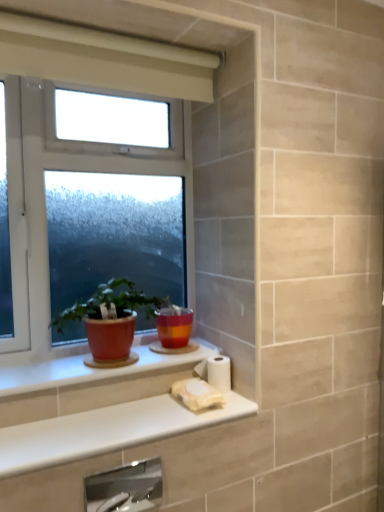
Question: From a real-world perspective, is white matte toilet paper at lower center, which is the second toilet paper from bottom to top, over white plastic window at center?

Choices:
 (A) no
 (B) yes

Answer: (A)

Question: Is white matte toilet paper at lower center, which is the second toilet paper from bottom to top, at the left side of white plastic window at center?

Choices:
 (A) yes
 (B) no

Answer: (B)

Question: Is white matte toilet paper at lower center, which is the first toilet paper from top to bottom, far away from white plastic window at center?

Choices:
 (A) yes
 (B) no

Answer: (B)

Question: Can you confirm if white matte toilet paper at lower center, which is the second toilet paper from bottom to top, is positioned to the right of white plastic window at center?

Choices:
 (A) yes
 (B) no

Answer: (A)

Question: Could you tell me if white matte toilet paper at lower center, which is the first toilet paper from top to bottom, is facing white plastic window at center?

Choices:
 (A) yes
 (B) no

Answer: (B)

Question: Does point (183, 361) appear closer or farther from the camera than point (127, 472)?

Choices:
 (A) farther
 (B) closer

Answer: (B)

Question: Looking at their shapes, would you say matte ceramic window sill at lower left is wider or thinner than satin nickel faucet at lower center?

Choices:
 (A) thin
 (B) wide

Answer: (B)

Question: From the image's perspective, is matte ceramic window sill at lower left above or below satin nickel faucet at lower center?

Choices:
 (A) above
 (B) below

Answer: (A)

Question: In terms of height, does matte ceramic window sill at lower left look taller or shorter compared to satin nickel faucet at lower center?

Choices:
 (A) short
 (B) tall

Answer: (A)

Question: Based on their sizes in the image, would you say matte ceramic pot at window is bigger or smaller than satin nickel faucet at lower center?

Choices:
 (A) big
 (B) small

Answer: (A)

Question: Considering the positions of point (137, 308) and point (124, 490), is point (137, 308) closer or farther from the camera than point (124, 490)?

Choices:
 (A) farther
 (B) closer

Answer: (B)

Question: Do you think matte ceramic pot at window is within satin nickel faucet at lower center, or outside of it?

Choices:
 (A) inside
 (B) outside

Answer: (B)

Question: Considering the positions of matte ceramic pot at window and satin nickel faucet at lower center in the image, is matte ceramic pot at window wider or thinner than satin nickel faucet at lower center?

Choices:
 (A) thin
 (B) wide

Answer: (B)

Question: From a real-world perspective, is white matte toilet paper at lower center, which is the first toilet paper from top to bottom, positioned above or below matte ceramic pot at window?

Choices:
 (A) below
 (B) above

Answer: (A)

Question: From the image's perspective, relative to matte ceramic pot at window, is white matte toilet paper at lower center, which is the second toilet paper from bottom to top, above or below?

Choices:
 (A) above
 (B) below

Answer: (B)